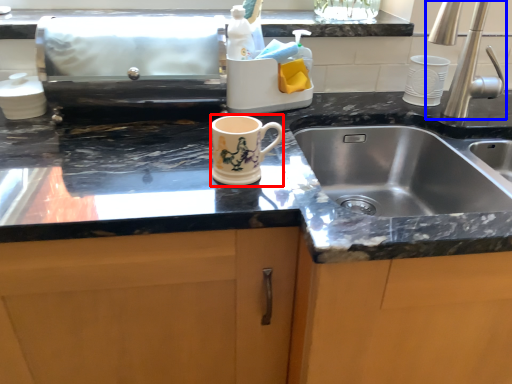
Question: Among these objects, which one is nearest to the camera, mug (highlighted by a red box) or tap (highlighted by a blue box)?

Choices:
 (A) mug
 (B) tap

Answer: (A)